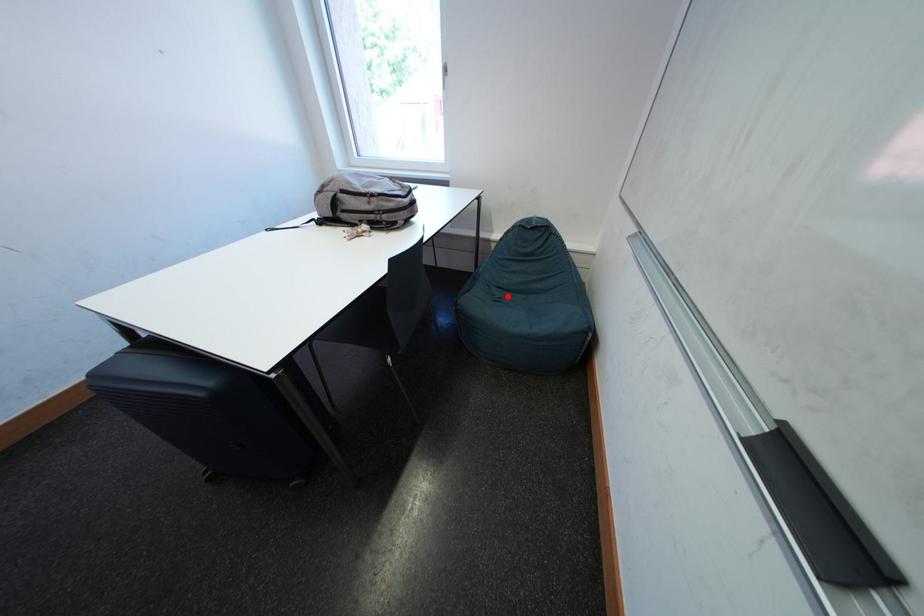
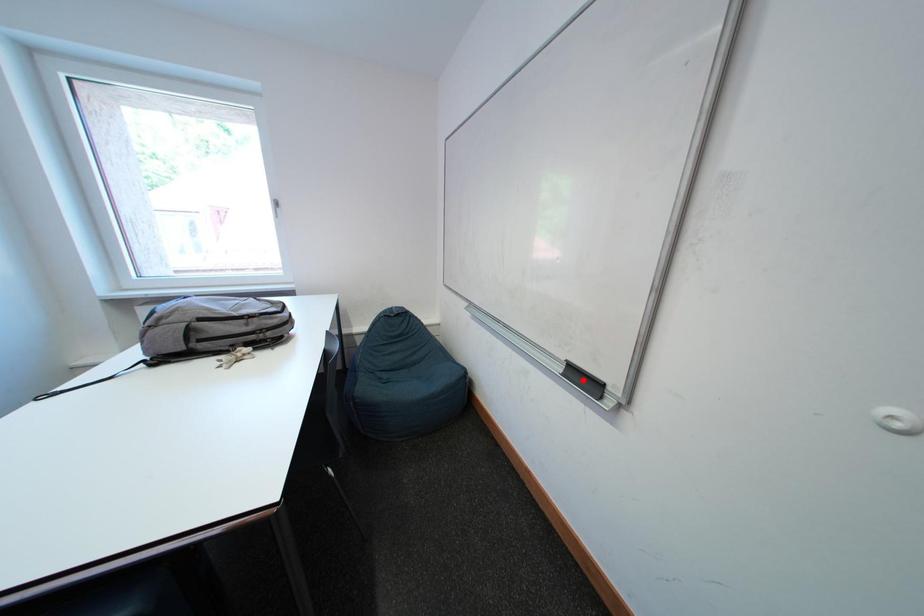
I am providing you with two images of the same scene from different viewpoints. A red point is marked on the first image and another point is marked on the second image. Are the points marked in image1 and image2 representing the same 3D position?

No